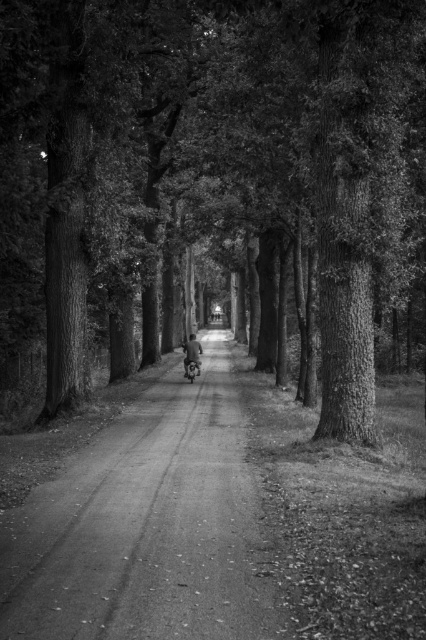
Question: Is smooth bark tree at center closer to camera compared to metallic silver motorcycle at center?

Choices:
 (A) yes
 (B) no

Answer: (A)

Question: Which point is closer to the camera?

Choices:
 (A) (131, 612)
 (B) (192, 364)

Answer: (A)

Question: Which object appears farthest from the camera in this image?

Choices:
 (A) smooth bark tree at center
 (B) smooth asphalt road at center
 (C) metallic silver motorcycle at center

Answer: (C)

Question: Can you confirm if smooth bark tree at center is wider than smooth asphalt road at center?

Choices:
 (A) no
 (B) yes

Answer: (B)

Question: Which object is the farthest from the smooth asphalt road at center?

Choices:
 (A) smooth bark tree at center
 (B) metallic silver motorcycle at center

Answer: (B)

Question: Is smooth bark tree at center closer to the viewer compared to smooth asphalt road at center?

Choices:
 (A) no
 (B) yes

Answer: (A)